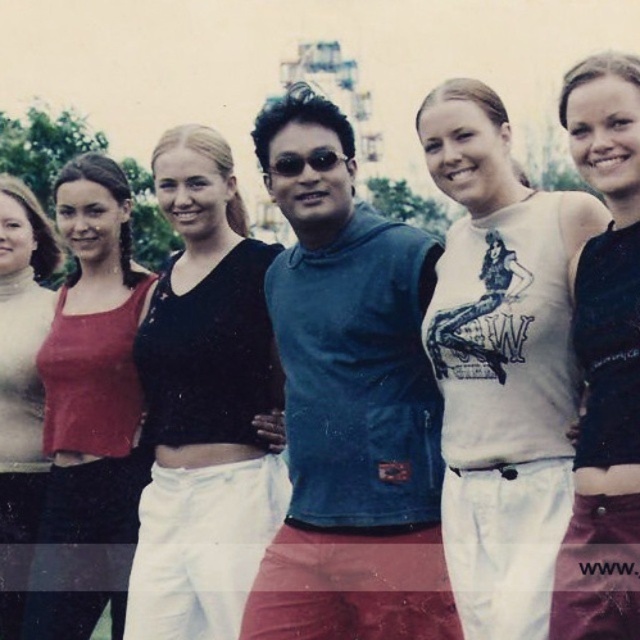
Does white cotton tank top at center have a larger size compared to matte black tank top at left?

Yes.

In the scene shown: Who is more distant from viewer, (440, 93) or (1, 445)?

The point (1, 445) is behind.

Locate an element on the screen. The width and height of the screenshot is (640, 640). white cotton tank top at center is located at coordinates (500, 362).

Between blue fabric sleeveless shirt at center and matte black tank top at left, which one has less height?

matte black tank top at left is shorter.

In the scene shown: Who is lower down, blue fabric sleeveless shirt at center or matte black tank top at left?

Positioned lower is matte black tank top at left.

This screenshot has height=640, width=640. I want to click on blue fabric sleeveless shirt at center, so click(x=349, y=406).

Is white cotton tank top at center closer to camera compared to black matte tank top at center?

No, white cotton tank top at center is further to the viewer.

From the picture: How far apart are white cotton tank top at center and black matte tank top at center?

white cotton tank top at center is 7.68 meters away from black matte tank top at center.

At what (x,y) coordinates should I click in order to perform the action: click on white cotton tank top at center. Please return your answer as a coordinate pair (x, y). Image resolution: width=640 pixels, height=640 pixels. Looking at the image, I should click on (500, 362).